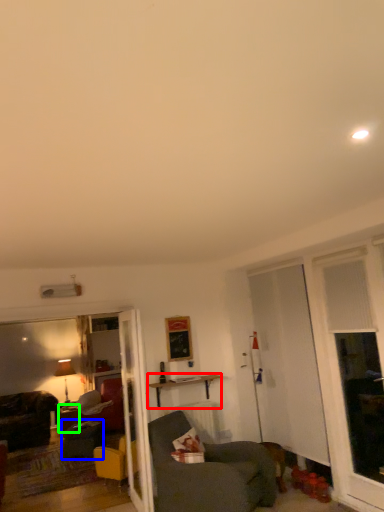
Question: Estimate the real-world distances between objects in this image. Which object is closer to table (highlighted by a red box), swivel chair (highlighted by a blue box) or desk (highlighted by a green box)?

Choices:
 (A) swivel chair
 (B) desk

Answer: (A)